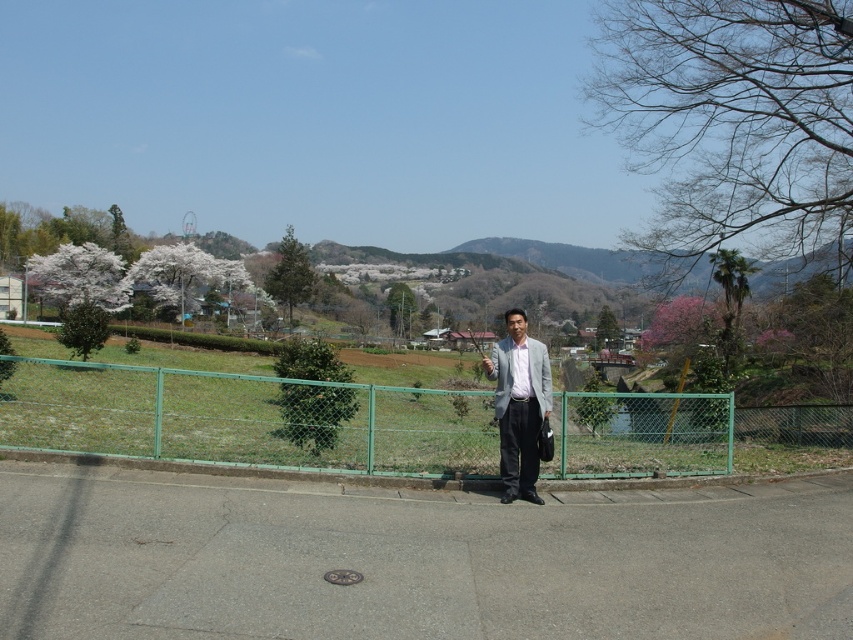
Is gray asphalt pavement at center further to camera compared to green chain-link fence at center?

No, it is in front of green chain-link fence at center.

What do you see at coordinates (415, 560) in the screenshot? The image size is (853, 640). I see `gray asphalt pavement at center` at bounding box center [415, 560].

Identify the location of gray asphalt pavement at center. This screenshot has width=853, height=640. (415, 560).

How much distance is there between gray asphalt pavement at center and light gray suit at center?

gray asphalt pavement at center is 9.21 feet from light gray suit at center.

Based on the photo, does gray asphalt pavement at center appear under light gray suit at center?

Yes.

Is point (663, 548) positioned after point (526, 496)?

No, (663, 548) is closer to viewer.

You are a GUI agent. You are given a task and a screenshot of the screen. Output one action in this format:
    pyautogui.click(x=<x>, y=<y>)
    Task: Click on the gray asphalt pavement at center
    The image size is (853, 640).
    Given the screenshot: What is the action you would take?
    pyautogui.click(x=415, y=560)

Can you confirm if green chain-link fence at center is shorter than light gray suit at center?

No.

The image size is (853, 640). Find the location of `green chain-link fence at center`. green chain-link fence at center is located at coordinates (247, 419).

Where is `green chain-link fence at center`? Image resolution: width=853 pixels, height=640 pixels. green chain-link fence at center is located at coordinates (247, 419).